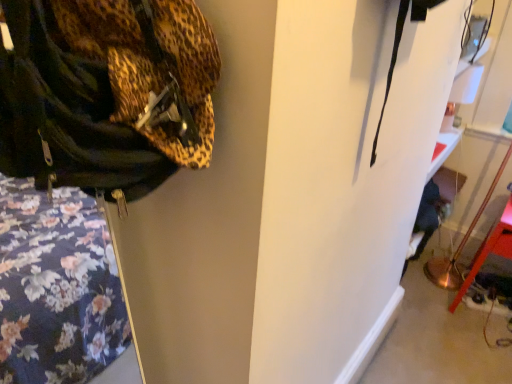
Question: Should I look upward or downward to see metallic gold floor lamp at lower right?

Choices:
 (A) up
 (B) down

Answer: (B)